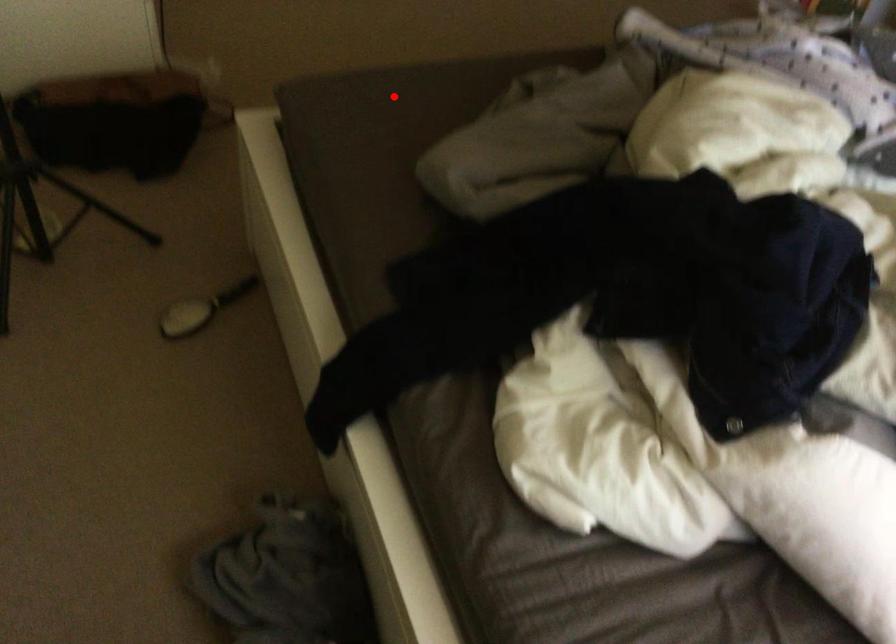
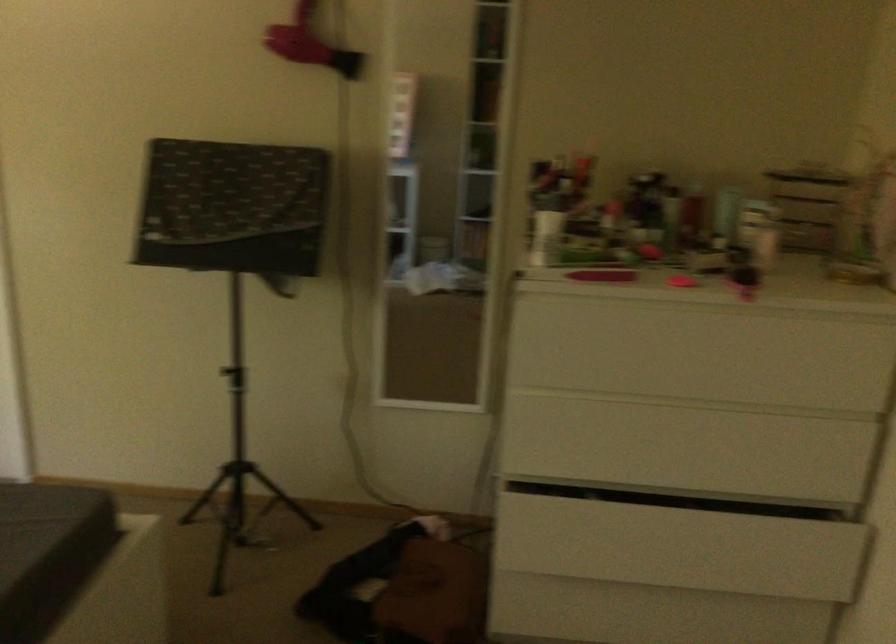
Find the pixel in the second image that matches the highlighted location in the first image.

(38, 523)